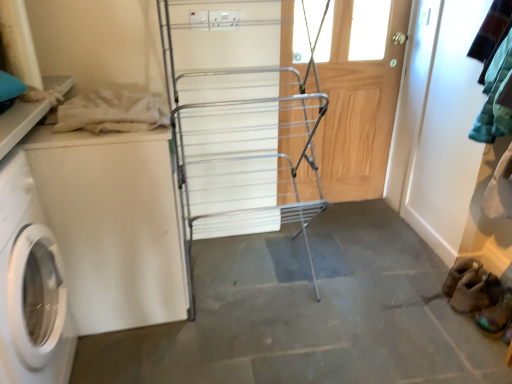
Where is `free space in front of brown suede shoe at lower right, the 1th shoe in the front-to-back sequence`? Image resolution: width=512 pixels, height=384 pixels. free space in front of brown suede shoe at lower right, the 1th shoe in the front-to-back sequence is located at coordinates (493, 358).